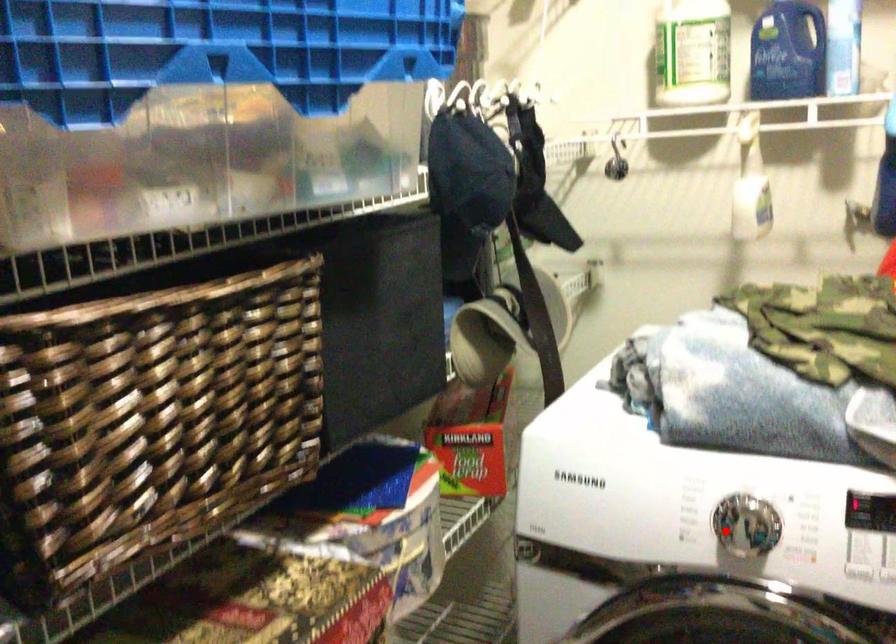
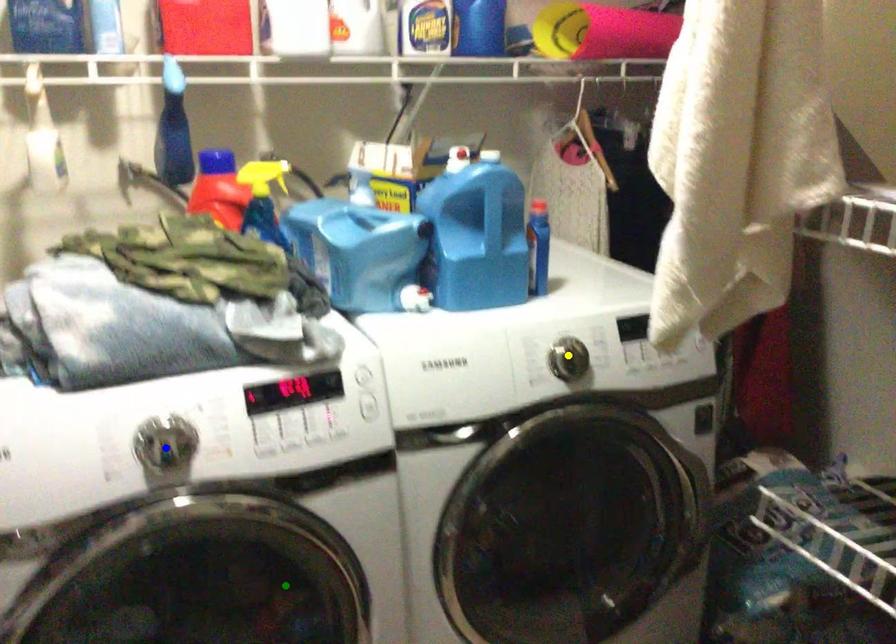
Question: I am providing you with two images of the same scene from different viewpoints. A red point is marked on the first image. You are given multiple points on the second image. In image 2, which mark is for the same physical point as the one in image 1?

Choices:
 (A) blue point
 (B) green point
 (C) yellow point

Answer: (A)